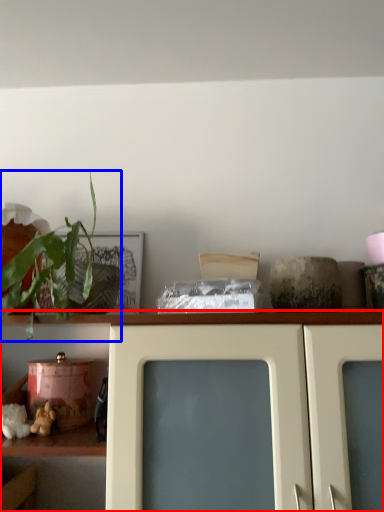
Question: Which object appears farthest to the camera in this image, shelf (highlighted by a red box) or houseplant (highlighted by a blue box)?

Choices:
 (A) shelf
 (B) houseplant

Answer: (A)